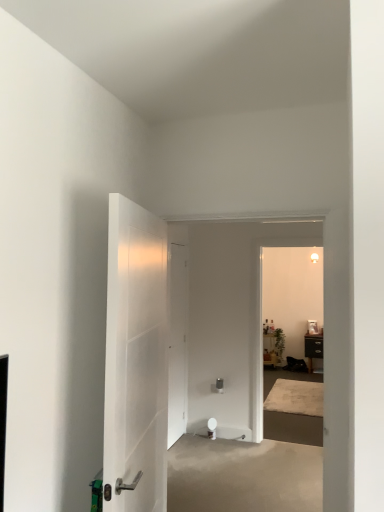
Identify the location of wooden side table at center, which is the second furniture in right-to-left order. The height and width of the screenshot is (512, 384). (270, 350).

The height and width of the screenshot is (512, 384). What do you see at coordinates (135, 360) in the screenshot?
I see `white glossy door at center, marked as the 2th door in a back-to-front arrangement` at bounding box center [135, 360].

At what (x,y) coordinates should I click in order to perform the action: click on white glossy door at center, marked as the 2th door in a back-to-front arrangement. Please return your answer as a coordinate pair (x, y). Looking at the image, I should click on (135, 360).

Identify the location of black matte cabinet at right, which is counted as the 2th furniture, starting from the left. The image size is (384, 512). (313, 347).

What do you see at coordinates (313, 347) in the screenshot?
I see `black matte cabinet at right, the 1th furniture viewed from the right` at bounding box center [313, 347].

At what (x,y) coordinates should I click in order to perform the action: click on beige concrete at center. Please return your answer as a coordinate pair (x, y). This screenshot has height=512, width=384. Looking at the image, I should click on (243, 476).

Locate an element on the screen. wooden side table at center, which ranks as the first furniture in left-to-right order is located at coordinates (270, 350).

Considering the points (150, 458) and (240, 498), which point is behind, point (150, 458) or point (240, 498)?

The point (240, 498) is more distant.

Is white glossy door at center, the 1th door when ordered from front to back, not near beige concrete at center?

Absolutely, white glossy door at center, the 1th door when ordered from front to back, is distant from beige concrete at center.

In terms of size, does white glossy door at center, marked as the 2th door in a back-to-front arrangement, appear bigger or smaller than beige concrete at center?

Considering their sizes, white glossy door at center, marked as the 2th door in a back-to-front arrangement, takes up less space than beige concrete at center.

Considering the sizes of objects black matte cabinet at right, the 1th furniture viewed from the right, and wooden side table at center, which ranks as the first furniture in left-to-right order, in the image provided, who is bigger, black matte cabinet at right, the 1th furniture viewed from the right, or wooden side table at center, which ranks as the first furniture in left-to-right order,?

Result: Bigger between the two is black matte cabinet at right, the 1th furniture viewed from the right.

Is black matte cabinet at right, which is counted as the 2th furniture, starting from the left, placed right next to wooden side table at center, which ranks as the first furniture in left-to-right order?

No, black matte cabinet at right, which is counted as the 2th furniture, starting from the left, is not next to wooden side table at center, which ranks as the first furniture in left-to-right order.

Is black matte cabinet at right, the 1th furniture viewed from the right, to the right of wooden side table at center, which is the second furniture in right-to-left order, from the viewer's perspective?

Yes, black matte cabinet at right, the 1th furniture viewed from the right, is to the right of wooden side table at center, which is the second furniture in right-to-left order.

From a real-world perspective, which object rests below the other?

wooden side table at center, which ranks as the first furniture in left-to-right order, is physically lower.

Is white matte door at center, placed as the 1th door when sorted from back to front, in contact with wooden side table at center, which is the second furniture in right-to-left order?

No, white matte door at center, placed as the 1th door when sorted from back to front, is not in contact with wooden side table at center, which is the second furniture in right-to-left order.

Based on the photo, would you say wooden side table at center, which ranks as the first furniture in left-to-right order, is part of white matte door at center, positioned as the 2th door in front-to-back order,'s contents?

No, wooden side table at center, which ranks as the first furniture in left-to-right order, is located outside of white matte door at center, positioned as the 2th door in front-to-back order.

From the image's perspective, which object appears higher, white matte door at center, placed as the 1th door when sorted from back to front, or wooden side table at center, which ranks as the first furniture in left-to-right order?

From the image's view, white matte door at center, placed as the 1th door when sorted from back to front, is above.

In the scene shown: Is white matte door at center, placed as the 1th door when sorted from back to front, to the left of wooden side table at center, which is the second furniture in right-to-left order, from the viewer's perspective?

Yes.

Is black matte cabinet at right, which is counted as the 2th furniture, starting from the left, looking in the opposite direction of white glossy door at center, the 1th door when ordered from front to back?

No.

Looking at this image, from a real-world perspective, is black matte cabinet at right, the 1th furniture viewed from the right, located beneath white glossy door at center, marked as the 2th door in a back-to-front arrangement?

Yes, from a real-world perspective, black matte cabinet at right, the 1th furniture viewed from the right, is beneath white glossy door at center, marked as the 2th door in a back-to-front arrangement.

From a real-world perspective, count 1st furnitures downward from the white glossy door at center, the 1th door when ordered from front to back, and point to it. Please provide its 2D coordinates.

[(313, 347)]

Could you measure the distance between black matte cabinet at right, which is counted as the 2th furniture, starting from the left, and white glossy door at center, marked as the 2th door in a back-to-front arrangement?

black matte cabinet at right, which is counted as the 2th furniture, starting from the left, is 6.92 meters from white glossy door at center, marked as the 2th door in a back-to-front arrangement.

From the image's perspective, is wooden side table at center, which ranks as the first furniture in left-to-right order, above or below black matte cabinet at right, which is counted as the 2th furniture, starting from the left?

wooden side table at center, which ranks as the first furniture in left-to-right order, is below black matte cabinet at right, which is counted as the 2th furniture, starting from the left.

Looking at this image, looking at the image, does wooden side table at center, which ranks as the first furniture in left-to-right order, seem bigger or smaller compared to black matte cabinet at right, the 1th furniture viewed from the right?

Considering their sizes, wooden side table at center, which ranks as the first furniture in left-to-right order, takes up less space than black matte cabinet at right, the 1th furniture viewed from the right.

The height and width of the screenshot is (512, 384). I want to click on furniture below the black matte cabinet at right, which is counted as the 2th furniture, starting from the left (from a real-world perspective), so click(270, 350).

Would you consider wooden side table at center, which is the second furniture in right-to-left order, to be distant from black matte cabinet at right, the 1th furniture viewed from the right?

wooden side table at center, which is the second furniture in right-to-left order, is actually quite close to black matte cabinet at right, the 1th furniture viewed from the right.

Is beige concrete at center beside wooden side table at center, which is the second furniture in right-to-left order?

No.

Is beige concrete at center to the left of wooden side table at center, which is the second furniture in right-to-left order, from the viewer's perspective?

Yes, beige concrete at center is to the left of wooden side table at center, which is the second furniture in right-to-left order.

Is beige concrete at center wider or thinner than wooden side table at center, which is the second furniture in right-to-left order?

In the image, beige concrete at center appears to be wider than wooden side table at center, which is the second furniture in right-to-left order.

Could you tell me if beige concrete at center is turned towards wooden side table at center, which ranks as the first furniture in left-to-right order?

No.

From the image's perspective, between white matte door at center, positioned as the 2th door in front-to-back order, and black matte cabinet at right, the 1th furniture viewed from the right, who is located below?

black matte cabinet at right, the 1th furniture viewed from the right, is shown below in the image.

Is black matte cabinet at right, which is counted as the 2th furniture, starting from the left, inside white matte door at center, placed as the 1th door when sorted from back to front?

No, black matte cabinet at right, which is counted as the 2th furniture, starting from the left, is located outside of white matte door at center, placed as the 1th door when sorted from back to front.

Consider the image. Could you tell me if white matte door at center, placed as the 1th door when sorted from back to front, is facing black matte cabinet at right, which is counted as the 2th furniture, starting from the left?

No, white matte door at center, placed as the 1th door when sorted from back to front, does not turn towards black matte cabinet at right, which is counted as the 2th furniture, starting from the left.

Can you confirm if white matte door at center, placed as the 1th door when sorted from back to front, is bigger than black matte cabinet at right, the 1th furniture viewed from the right?

Incorrect, white matte door at center, placed as the 1th door when sorted from back to front, is not larger than black matte cabinet at right, the 1th furniture viewed from the right.

Identify the location of concrete below the white glossy door at center, marked as the 2th door in a back-to-front arrangement (from the image's perspective). This screenshot has width=384, height=512. (243, 476).

At what (x,y) coordinates should I click in order to perform the action: click on furniture located above the wooden side table at center, which is the second furniture in right-to-left order (from the image's perspective). Please return your answer as a coordinate pair (x, y). Looking at the image, I should click on (313, 347).

Estimate the real-world distances between objects in this image. Which object is closer to beige concrete at center, white matte door at center, positioned as the 2th door in front-to-back order, or black matte cabinet at right, the 1th furniture viewed from the right?

Answer: white matte door at center, positioned as the 2th door in front-to-back order, is closer to beige concrete at center.

Based on their spatial positions, is black matte cabinet at right, which is counted as the 2th furniture, starting from the left, or beige concrete at center further from white glossy door at center, marked as the 2th door in a back-to-front arrangement?

Among the two, black matte cabinet at right, which is counted as the 2th furniture, starting from the left, is located further to white glossy door at center, marked as the 2th door in a back-to-front arrangement.

Based on their spatial positions, is white matte door at center, placed as the 1th door when sorted from back to front, or white glossy door at center, marked as the 2th door in a back-to-front arrangement, further from wooden side table at center, which ranks as the first furniture in left-to-right order?

white glossy door at center, marked as the 2th door in a back-to-front arrangement, is positioned further to the anchor wooden side table at center, which ranks as the first furniture in left-to-right order.

Looking at the image, which one is located closer to beige concrete at center, wooden side table at center, which ranks as the first furniture in left-to-right order, or black matte cabinet at right, which is counted as the 2th furniture, starting from the left?

Based on the image, black matte cabinet at right, which is counted as the 2th furniture, starting from the left, appears to be nearer to beige concrete at center.

Considering their positions, is white glossy door at center, the 1th door when ordered from front to back, positioned further to black matte cabinet at right, which is counted as the 2th furniture, starting from the left, than beige concrete at center?

white glossy door at center, the 1th door when ordered from front to back, is positioned further to the anchor black matte cabinet at right, which is counted as the 2th furniture, starting from the left.

Which object lies nearer to the anchor point white matte door at center, placed as the 1th door when sorted from back to front, wooden side table at center, which ranks as the first furniture in left-to-right order, or black matte cabinet at right, which is counted as the 2th furniture, starting from the left?

wooden side table at center, which ranks as the first furniture in left-to-right order, is closer to white matte door at center, placed as the 1th door when sorted from back to front.

From the image, which object appears to be nearer to black matte cabinet at right, the 1th furniture viewed from the right, beige concrete at center or white matte door at center, positioned as the 2th door in front-to-back order?

white matte door at center, positioned as the 2th door in front-to-back order, is closer to black matte cabinet at right, the 1th furniture viewed from the right.

Considering their positions, is wooden side table at center, which ranks as the first furniture in left-to-right order, positioned closer to black matte cabinet at right, which is counted as the 2th furniture, starting from the left, than beige concrete at center?

Based on the image, wooden side table at center, which ranks as the first furniture in left-to-right order, appears to be nearer to black matte cabinet at right, which is counted as the 2th furniture, starting from the left.

The image size is (384, 512). I want to click on concrete positioned between white glossy door at center, marked as the 2th door in a back-to-front arrangement, and black matte cabinet at right, which is counted as the 2th furniture, starting from the left, from near to far, so click(243, 476).

Find the location of a particular element. furniture between beige concrete at center and wooden side table at center, which ranks as the first furniture in left-to-right order, along the z-axis is located at coordinates (313, 347).

Locate an element on the screen. door between beige concrete at center and wooden side table at center, which is the second furniture in right-to-left order, along the z-axis is located at coordinates (177, 342).

Find the location of a particular element. The height and width of the screenshot is (512, 384). door between white glossy door at center, the 1th door when ordered from front to back, and black matte cabinet at right, which is counted as the 2th furniture, starting from the left, in the front-back direction is located at coordinates (177, 342).